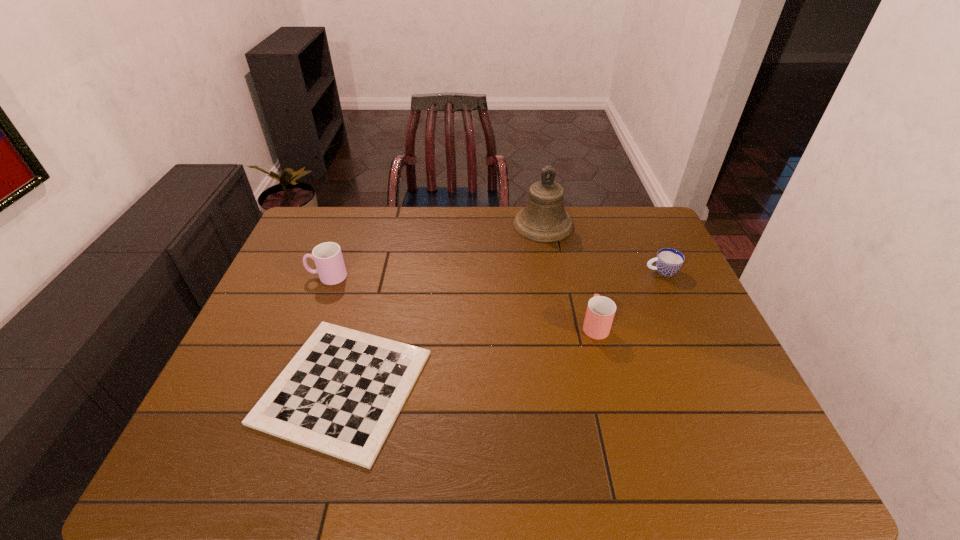
This screenshot has height=540, width=960. What are the coordinates of `free space located 0.190m on the side of the nearest cup with the handle` in the screenshot? It's located at (580, 267).

Where is `vacant space located on the side of the nearest cup with the handle`? The height and width of the screenshot is (540, 960). vacant space located on the side of the nearest cup with the handle is located at coordinates (573, 239).

The image size is (960, 540). Identify the location of free region located on the side of the rightmost object with the handle. (600, 272).

This screenshot has width=960, height=540. In order to click on free space located 0.380m on the side of the rightmost object with the handle in this screenshot , I will do `click(524, 272)`.

Locate an element on the screen. free location located on the side of the rightmost object with the handle is located at coordinates (581, 272).

Find the location of `free space located 0.150m on the back of the shortest object`. free space located 0.150m on the back of the shortest object is located at coordinates (371, 287).

This screenshot has height=540, width=960. What are the coordinates of `object that is at the far edge` in the screenshot? It's located at (544, 219).

You are a GUI agent. You are given a task and a screenshot of the screen. Output one action in this format:
    pyautogui.click(x=<x>, y=<y>)
    Task: Click on the object that is positioned at the near edge
    This screenshot has width=960, height=540.
    Given the screenshot: What is the action you would take?
    pyautogui.click(x=341, y=393)

At what (x,y) coordinates should I click in order to perform the action: click on cup located in the left edge section of the desktop. Please return your answer as a coordinate pair (x, y). Looking at the image, I should click on (327, 256).

The height and width of the screenshot is (540, 960). Identify the location of checkerboard situated at the left edge. (341, 393).